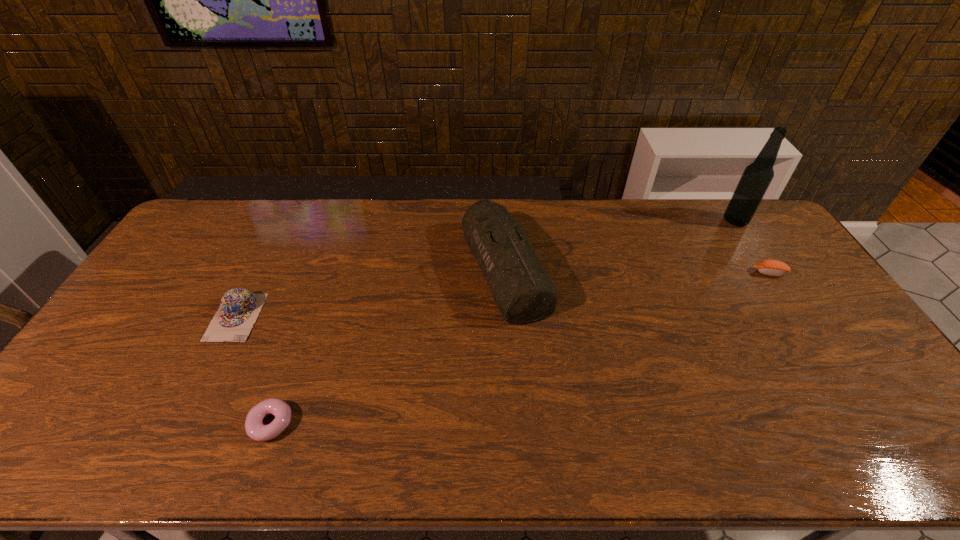
The height and width of the screenshot is (540, 960). I want to click on free space at the near edge of the desktop, so pyautogui.click(x=368, y=450).

Identify the location of free space at the left edge of the desktop. The height and width of the screenshot is (540, 960). (157, 302).

The height and width of the screenshot is (540, 960). I want to click on vacant space at the right edge of the desktop, so click(x=830, y=364).

The image size is (960, 540). Find the location of `vacant space at the far left corner of the desktop`. vacant space at the far left corner of the desktop is located at coordinates (225, 240).

The image size is (960, 540). In order to click on free spot between the duffel bag and the shortest object in this screenshot , I will do `click(388, 346)`.

Locate an element on the screen. The image size is (960, 540). free point between the shortest object and the sushi is located at coordinates (520, 348).

Image resolution: width=960 pixels, height=540 pixels. I want to click on free area in between the nearest object and the leftmost object, so click(253, 370).

Locate an element on the screen. This screenshot has height=540, width=960. empty space that is in between the fourth shortest object and the sushi is located at coordinates (636, 271).

The height and width of the screenshot is (540, 960). I want to click on free space that is in between the third object from right to left and the tallest object, so click(x=620, y=245).

Find the location of a particular element. free point between the tallest object and the fourth tallest object is located at coordinates (752, 247).